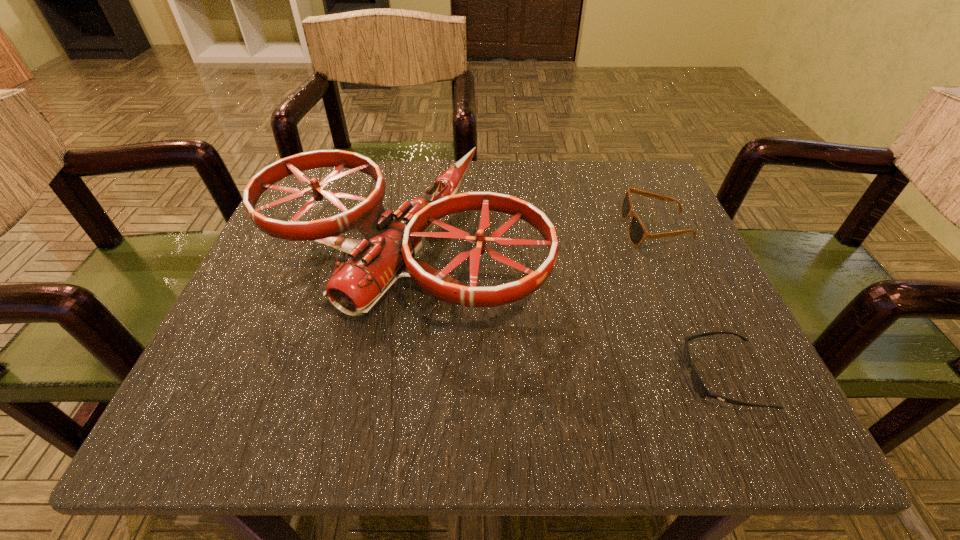
Where is `vacant region at the far edge of the desktop`? This screenshot has width=960, height=540. vacant region at the far edge of the desktop is located at coordinates (396, 208).

At what (x,y) coordinates should I click in order to perform the action: click on vacant space at the near edge of the desktop. Please return your answer as a coordinate pair (x, y). Looking at the image, I should click on (424, 421).

Find the location of a particular element. The height and width of the screenshot is (540, 960). vacant space at the left edge is located at coordinates (x=248, y=288).

At what (x,y) coordinates should I click in order to perform the action: click on blank space at the right edge of the desktop. Please return your answer as a coordinate pair (x, y). Looking at the image, I should click on (660, 351).

This screenshot has height=540, width=960. In the image, there is a desktop. Identify the location of vacant space at the far left corner. (352, 186).

At what (x,y) coordinates should I click in order to perform the action: click on vacant region at the near left corner of the desktop. Please return your answer as a coordinate pair (x, y). This screenshot has width=960, height=540. Looking at the image, I should click on (213, 433).

Find the location of a particular element. empty space between the taller sunglasses and the tallest object is located at coordinates (530, 238).

Find the location of `unoccupied position between the tallest object and the farther sunglasses`. unoccupied position between the tallest object and the farther sunglasses is located at coordinates (530, 238).

Where is `unoccupied position between the shorter sunglasses and the leftmost object`? This screenshot has width=960, height=540. unoccupied position between the shorter sunglasses and the leftmost object is located at coordinates (564, 312).

I want to click on free point between the shorter sunglasses and the farther sunglasses, so click(689, 302).